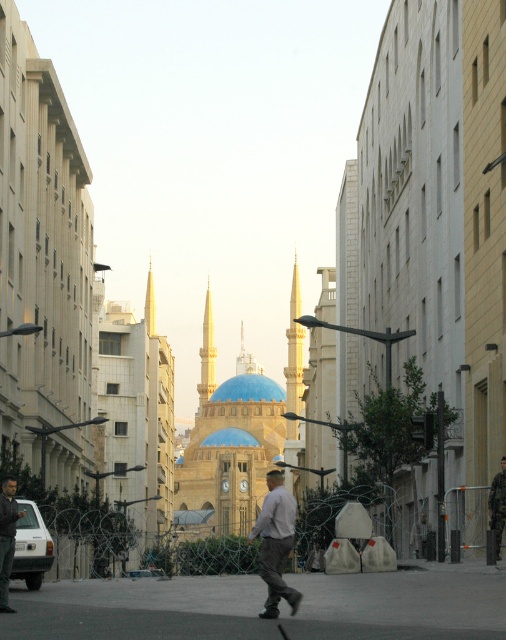
Question: Which is farther from the light brown leather jacket at center?

Choices:
 (A) gray asphalt pavement at center
 (B) khaki cotton pants at center

Answer: (B)

Question: Which point is closer to the camera?

Choices:
 (A) light yellow stone spire at center
 (B) light gray fabric shirt at center
 (C) light brown leather jacket at center
 (D) gray asphalt pavement at center

Answer: (D)

Question: Is light gray fabric shirt at center below light yellow stone spire at center?

Choices:
 (A) no
 (B) yes

Answer: (B)

Question: Does light brown leather jacket at center appear on the left side of light yellow stone spire at center?

Choices:
 (A) no
 (B) yes

Answer: (A)

Question: Among these objects, which one is farthest from the camera?

Choices:
 (A) khaki cotton pants at center
 (B) light yellow stone spire at center

Answer: (B)

Question: Can you confirm if light yellow stone spire at center is positioned above khaki cotton pants at center?

Choices:
 (A) no
 (B) yes

Answer: (B)